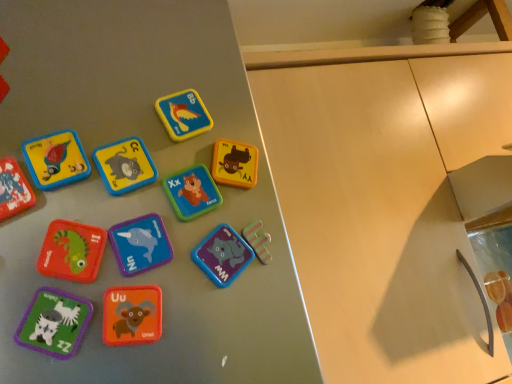
Question: Should I look upward or downward to see matte wood cabinet at center?

Choices:
 (A) up
 (B) down

Answer: (B)

Question: Is matte green fabric zebra at lower left, which is the 2th toy in bottom-to-top order, not within matte yellow square at upper center, which is counted as the 1th toy, starting from the top?

Choices:
 (A) no
 (B) yes

Answer: (B)

Question: Considering the relative sizes of matte green fabric zebra at lower left, which is the 2th toy in bottom-to-top order, and matte yellow square at upper center, the tenth toy ordered from the bottom, in the image provided, is matte green fabric zebra at lower left, which is the 2th toy in bottom-to-top order, wider than matte yellow square at upper center, the tenth toy ordered from the bottom,?

Choices:
 (A) no
 (B) yes

Answer: (B)

Question: Could matte yellow square at upper center, which is counted as the 1th toy, starting from the top, be considered to be inside matte green fabric zebra at lower left, which is the 2th toy in bottom-to-top order?

Choices:
 (A) no
 (B) yes

Answer: (A)

Question: Considering the relative sizes of matte green fabric zebra at lower left, arranged as the ninth toy when viewed from the top, and matte yellow square at upper center, which is counted as the 1th toy, starting from the top, in the image provided, is matte green fabric zebra at lower left, arranged as the ninth toy when viewed from the top, shorter than matte yellow square at upper center, which is counted as the 1th toy, starting from the top,?

Choices:
 (A) no
 (B) yes

Answer: (A)

Question: From the image's perspective, is matte green fabric zebra at lower left, arranged as the ninth toy when viewed from the top, beneath matte yellow square at upper center, which is counted as the 1th toy, starting from the top?

Choices:
 (A) yes
 (B) no

Answer: (A)

Question: From the image's perspective, is matte green fabric zebra at lower left, arranged as the ninth toy when viewed from the top, on matte yellow square at upper center, the tenth toy ordered from the bottom?

Choices:
 (A) yes
 (B) no

Answer: (B)

Question: Is matte plastic letter at center, marked as the 3th toy in a top-to-bottom arrangement, behind purple matte magnet at center, marked as the third toy in a bottom-to-top arrangement?

Choices:
 (A) no
 (B) yes

Answer: (B)

Question: From a real-world perspective, is matte plastic letter at center, positioned as the eighth toy in bottom-to-top order, on top of purple matte magnet at center, which appears as the 8th toy when viewed from the top?

Choices:
 (A) no
 (B) yes

Answer: (B)

Question: Can we say matte plastic letter at center, positioned as the eighth toy in bottom-to-top order, lies outside purple matte magnet at center, which appears as the 8th toy when viewed from the top?

Choices:
 (A) no
 (B) yes

Answer: (B)

Question: Would you say purple matte magnet at center, which appears as the 8th toy when viewed from the top, is part of matte plastic letter at center, positioned as the eighth toy in bottom-to-top order,'s contents?

Choices:
 (A) no
 (B) yes

Answer: (A)

Question: Can you confirm if matte plastic letter at center, marked as the 3th toy in a top-to-bottom arrangement, is positioned to the right of purple matte magnet at center, marked as the third toy in a bottom-to-top arrangement?

Choices:
 (A) yes
 (B) no

Answer: (B)

Question: Is matte plastic letter at center, positioned as the eighth toy in bottom-to-top order, positioned far away from purple matte magnet at center, which appears as the 8th toy when viewed from the top?

Choices:
 (A) no
 (B) yes

Answer: (A)

Question: From the image's perspective, does purple matte magnet at center, marked as the third toy in a bottom-to-top arrangement, appear lower than matte plastic letter at center, marked as the 3th toy in a top-to-bottom arrangement?

Choices:
 (A) yes
 (B) no

Answer: (A)